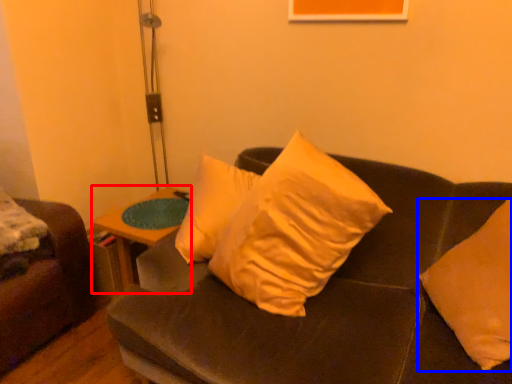
Question: Which object appears closest to the camera in this image, table (highlighted by a red box) or pillow (highlighted by a blue box)?

Choices:
 (A) table
 (B) pillow

Answer: (B)